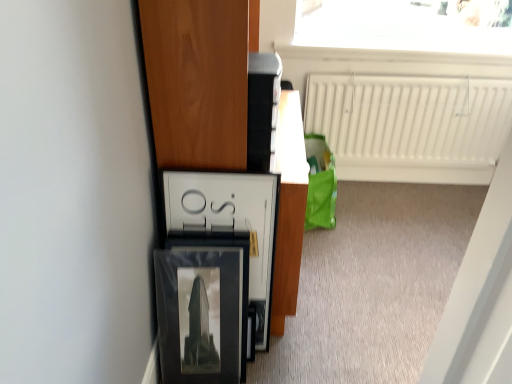
At what (x,y) coordinates should I click in order to perform the action: click on vacant area that is in front of white matte radiator at upper right. Please return your answer as a coordinate pair (x, y). This screenshot has width=512, height=384. Looking at the image, I should click on (401, 244).